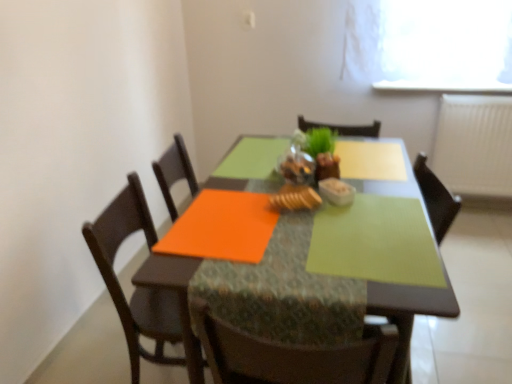
Question: In terms of height, does matte glass table at center look taller or shorter compared to green matte houseplant at center?

Choices:
 (A) short
 (B) tall

Answer: (B)

Question: Is matte glass table at center to the left or to the right of green matte houseplant at center in the image?

Choices:
 (A) left
 (B) right

Answer: (A)

Question: Which of these objects is positioned farthest from the green matte placemat at center?

Choices:
 (A) white textured radiator at right
 (B) matte glass table at center
 (C) baked golden bread at center
 (D) green matte placemat at center
 (E) green matte houseplant at center

Answer: (A)

Question: Estimate the real-world distances between objects in this image. Which object is closer to the white textured radiator at right?

Choices:
 (A) green matte placemat at center
 (B) white glossy bowl at center
 (C) green matte placemat at center
 (D) matte glass table at center
 (E) green matte houseplant at center

Answer: (C)